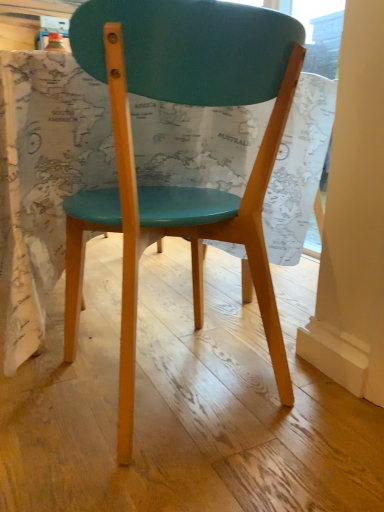
Image resolution: width=384 pixels, height=512 pixels. Find the location of `teal matte wood chair at center`. teal matte wood chair at center is located at coordinates (180, 187).

The height and width of the screenshot is (512, 384). Describe the element at coordinates (180, 187) in the screenshot. I see `teal matte wood chair at center` at that location.

I want to click on teal matte wood chair at center, so click(x=180, y=187).